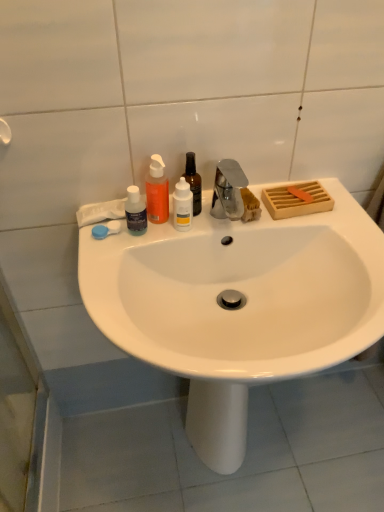
The width and height of the screenshot is (384, 512). What are the coordinates of `free location to the right of white matte bottle at center, which is counted as the second bottle, starting from the right` in the screenshot? It's located at (240, 225).